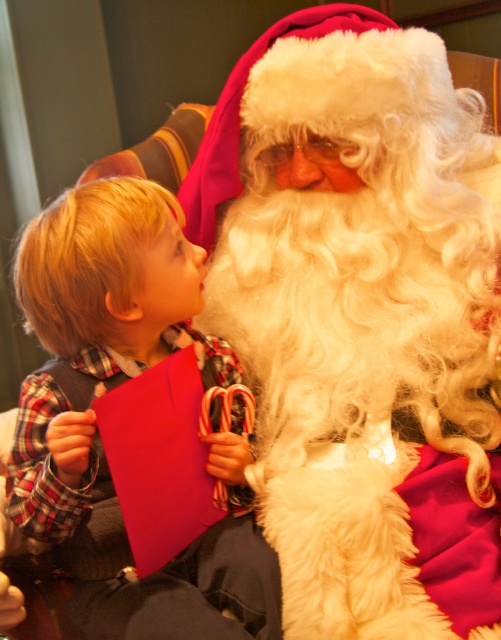
Can you confirm if white fluffy beard at center is positioned above plaid fabric shirt at left?

Indeed, white fluffy beard at center is positioned over plaid fabric shirt at left.

Where is `white fluffy beard at center`? The width and height of the screenshot is (501, 640). white fluffy beard at center is located at coordinates [362, 321].

You are a GUI agent. You are given a task and a screenshot of the screen. Output one action in this format:
    pyautogui.click(x=<x>, y=<y>)
    Task: Click on the white fluffy beard at center
    The height and width of the screenshot is (640, 501).
    Given the screenshot: What is the action you would take?
    pyautogui.click(x=362, y=321)